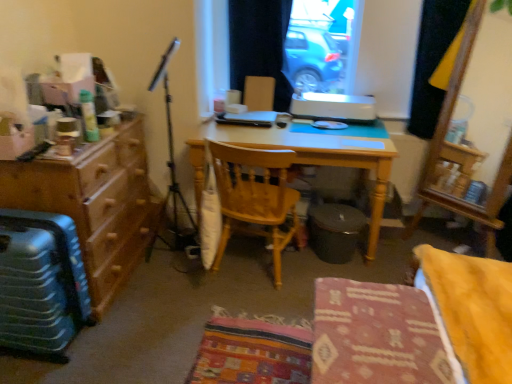
Where is `empty space that is ontop of patterned fabric chair at center, marked as the 2th chair in a back-to-front arrangement (from a real-world perspective)`? The height and width of the screenshot is (384, 512). empty space that is ontop of patterned fabric chair at center, marked as the 2th chair in a back-to-front arrangement (from a real-world perspective) is located at coordinates (378, 323).